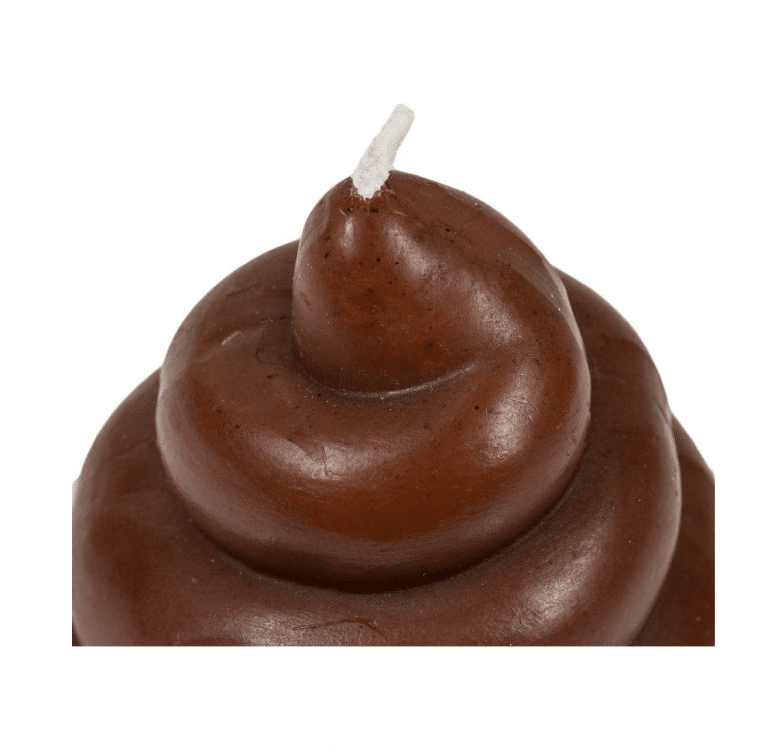
Identify the location of candle. (381, 161).